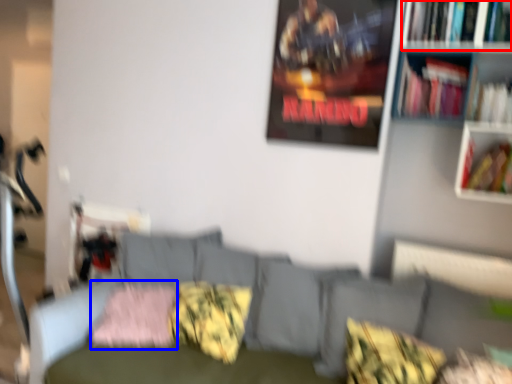
Question: Which object is further to the camera taking this photo, book (highlighted by a red box) or pillow (highlighted by a blue box)?

Choices:
 (A) book
 (B) pillow

Answer: (B)